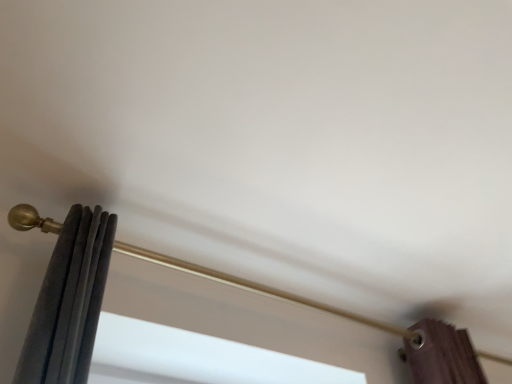
This screenshot has width=512, height=384. Describe the element at coordinates (196, 358) in the screenshot. I see `white plastic window frame at center` at that location.

I want to click on white plastic window frame at center, so click(x=196, y=358).

Locate an element on the screen. The height and width of the screenshot is (384, 512). white plastic window frame at center is located at coordinates (196, 358).